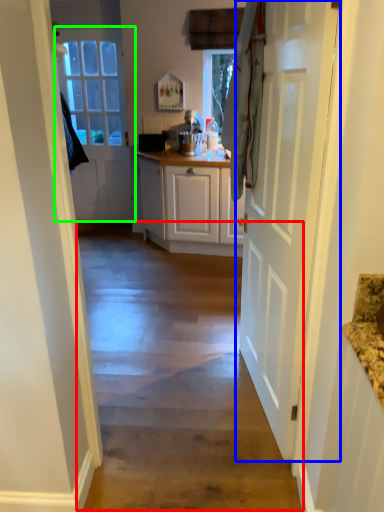
Question: Which object is positioned farthest from path (highlighted by a red box)? Select from door (highlighted by a blue box) and door (highlighted by a green box).

Choices:
 (A) door
 (B) door

Answer: (B)